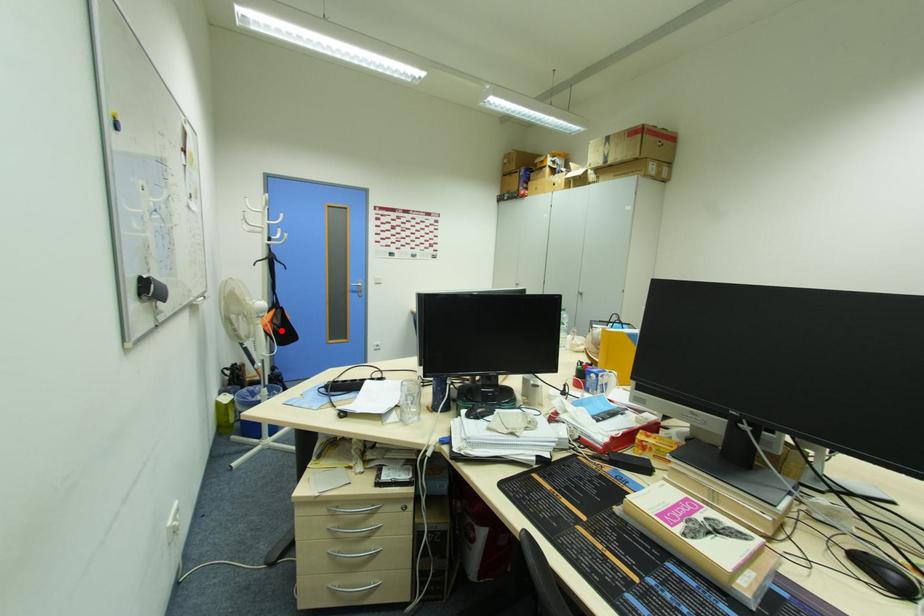
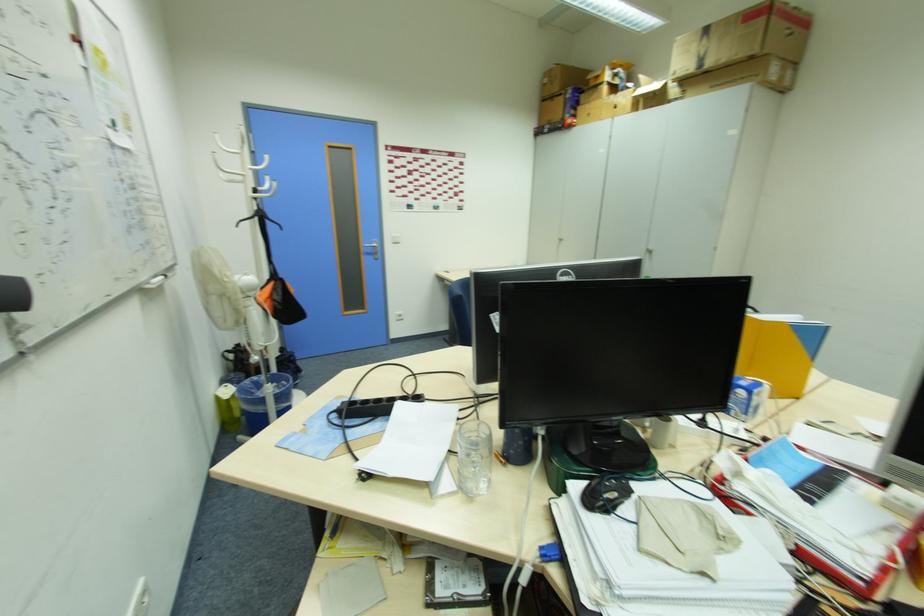
Where in the second image is the point corresponding to the highlighted location from the first image?

(283, 309)